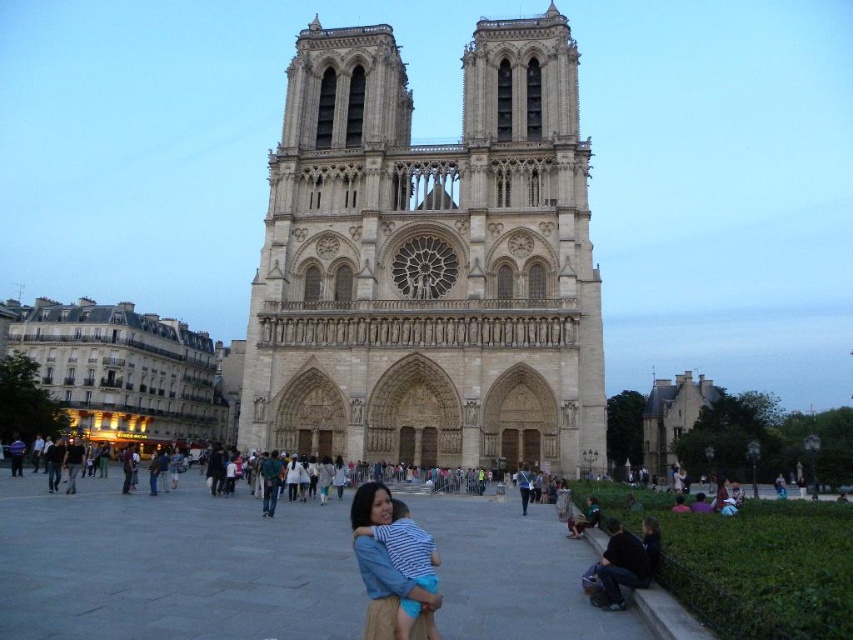
Question: Is brown stone building at left further to camera compared to dark blue jeans at lower right?

Choices:
 (A) yes
 (B) no

Answer: (A)

Question: Can you confirm if beige stone cathedral at center is bigger than dark blue jeans at lower right?

Choices:
 (A) yes
 (B) no

Answer: (A)

Question: Can you confirm if brown stone building at left is positioned to the right of dark blue jeans at lower right?

Choices:
 (A) no
 (B) yes

Answer: (A)

Question: Among these points, which one is nearest to the camera?

Choices:
 (A) (564, 426)
 (B) (590, 596)
 (C) (212, 436)
 (D) (679, 397)

Answer: (B)

Question: Considering the real-world distances, which object is closest to the blue striped shirt at center?

Choices:
 (A) smooth stone church at lower right
 (B) beige stone cathedral at center

Answer: (B)

Question: Which point is farther from the camera taking this photo?

Choices:
 (A) (369, 600)
 (B) (526, 470)
 (C) (683, 422)
 (D) (65, 380)

Answer: (D)